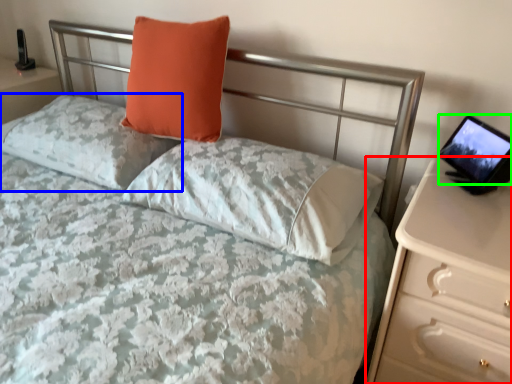
Question: Which object is the farthest from nightstand (highlighted by a red box)? Choose among these: pillow (highlighted by a blue box) or computer screen (highlighted by a green box).

Choices:
 (A) pillow
 (B) computer screen

Answer: (A)